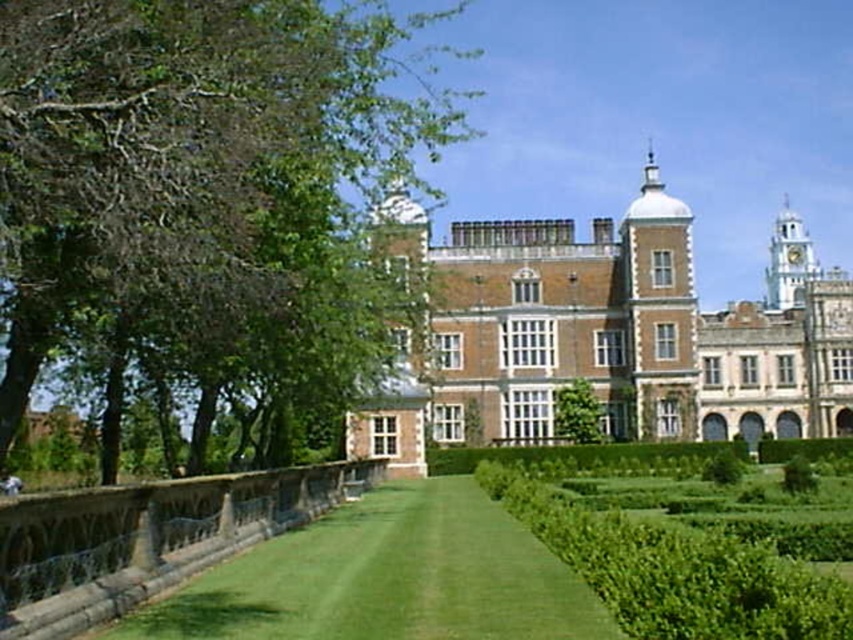
You are a visitor standing at the entrance of the grand historic building. You notice a green leafy tree at upper left and green grass at center in the scene. Which of these two elements is positioned higher in the image?

The green leafy tree at upper left is positioned higher than the green grass at center in the image.

You are standing on the lawn and want to take a photo of the historic building. To ensure both the green leafy tree at upper left and the green grass at center are in the frame, should you position yourself to the left or right of the tree?

You should position yourself to the right of the green leafy tree at upper left because it is to the left of the green grass at center, so placing yourself to the right of the tree will keep both objects within the camera frame.